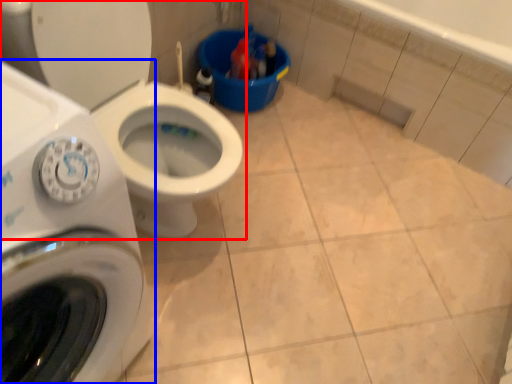
Question: Which object is further to the camera taking this photo, toilet (highlighted by a red box) or washing machine (highlighted by a blue box)?

Choices:
 (A) toilet
 (B) washing machine

Answer: (A)